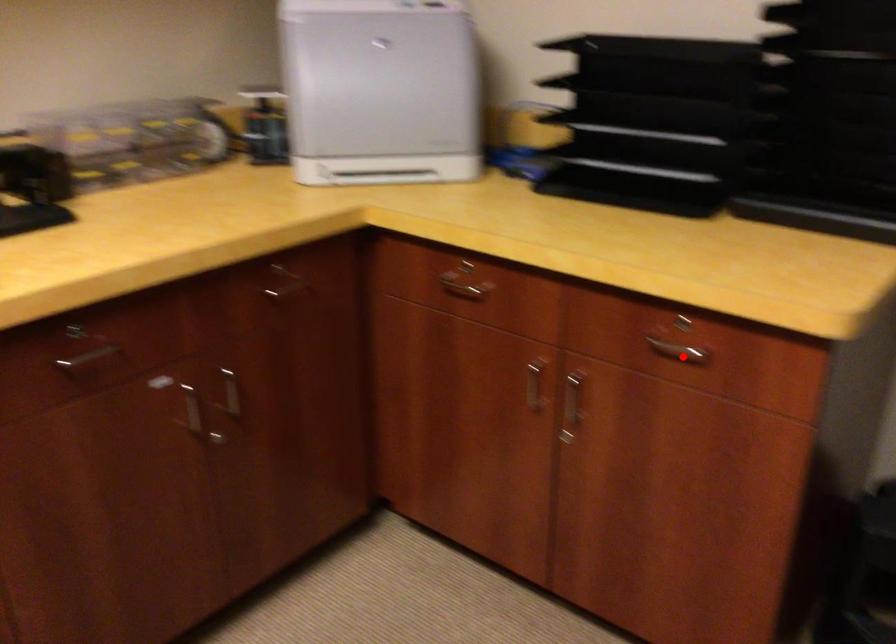
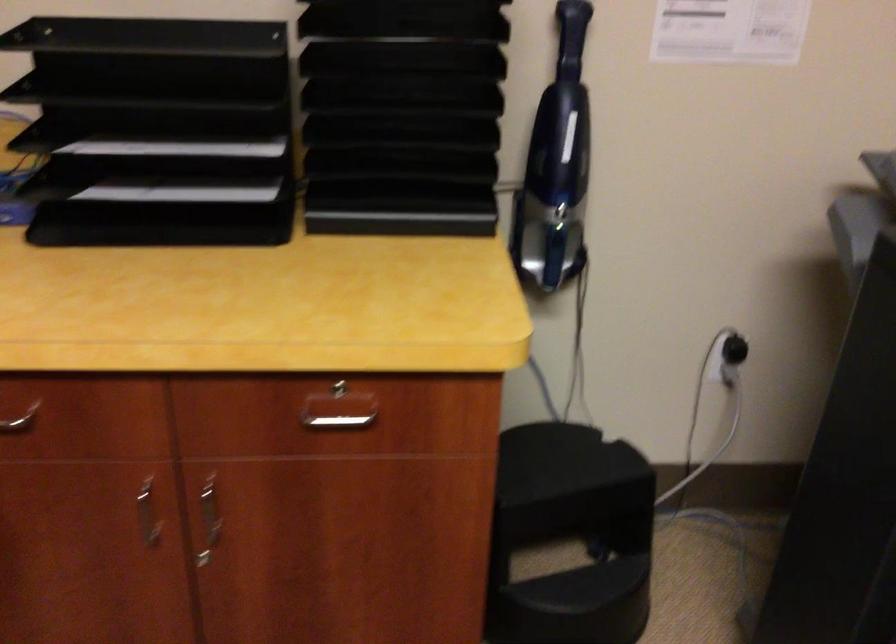
Locate, in the second image, the point that corresponds to the highlighted location in the first image.

(338, 422)